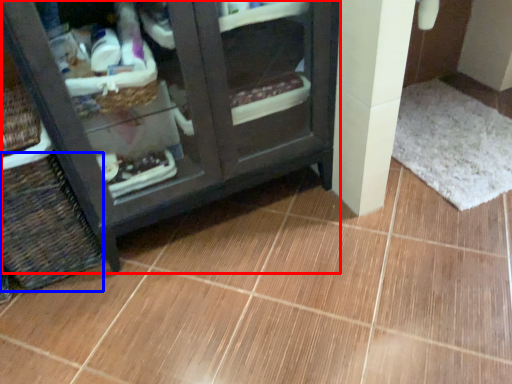
Question: Which object is closer to the camera taking this photo, furniture (highlighted by a red box) or basket (highlighted by a blue box)?

Choices:
 (A) furniture
 (B) basket

Answer: (A)